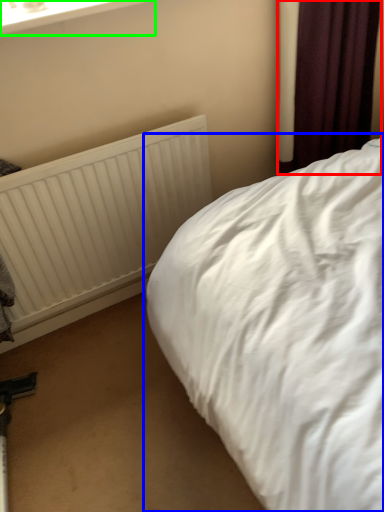
Question: Which object is positioned closest to curtain (highlighted by a red box)? Select from bed (highlighted by a blue box) and window frame (highlighted by a green box).

Choices:
 (A) bed
 (B) window frame

Answer: (A)